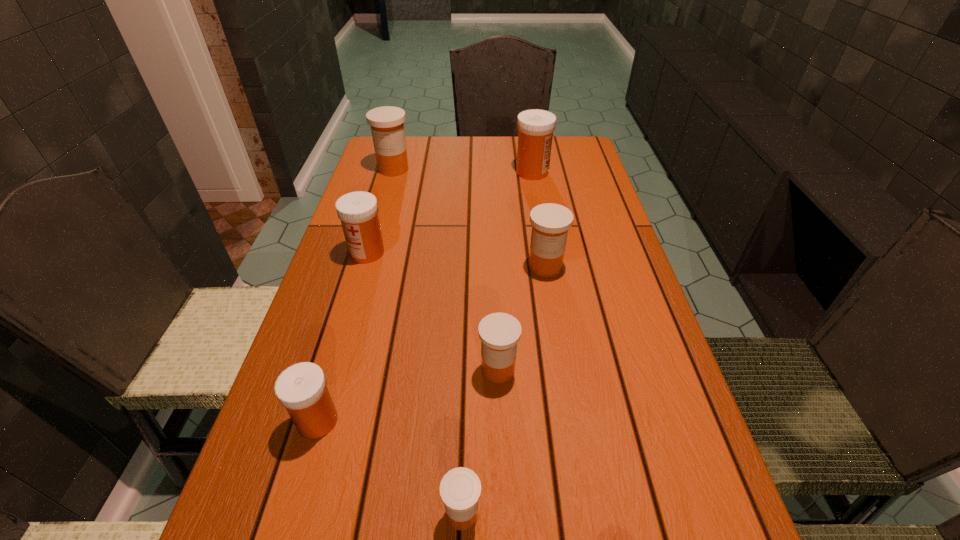
Identify the location of the nearest white medicine. (301, 388).

Find the location of a particular element. This screenshot has width=960, height=540. the smallest orange medicine is located at coordinates (460, 489).

Where is `the shortest medicine`? Image resolution: width=960 pixels, height=540 pixels. the shortest medicine is located at coordinates (460, 489).

Identify the location of free space located 0.330m on the front of the biggest white medicine. The image size is (960, 540). (545, 249).

The image size is (960, 540). What are the coordinates of `vacant area situated on the label of the farthest orange medicine` in the screenshot? It's located at (377, 226).

The image size is (960, 540). Identify the location of free spot located on the label of the rightmost orange medicine. (559, 352).

The width and height of the screenshot is (960, 540). What are the coordinates of `vacant space located on the front of the second biggest white medicine` in the screenshot? It's located at (357, 288).

At what (x,y) coordinates should I click in order to perform the action: click on vacant position located 0.050m on the label of the fifth farthest object. Please return your answer as a coordinate pair (x, y). This screenshot has width=960, height=540. Looking at the image, I should click on (452, 369).

Locate an element on the screen. Image resolution: width=960 pixels, height=540 pixels. vacant space situated on the label of the fifth farthest object is located at coordinates (432, 369).

At what (x,y) coordinates should I click in order to perform the action: click on vacant space located on the label of the fifth farthest object. Please return your answer as a coordinate pair (x, y). Image resolution: width=960 pixels, height=540 pixels. Looking at the image, I should click on (421, 369).